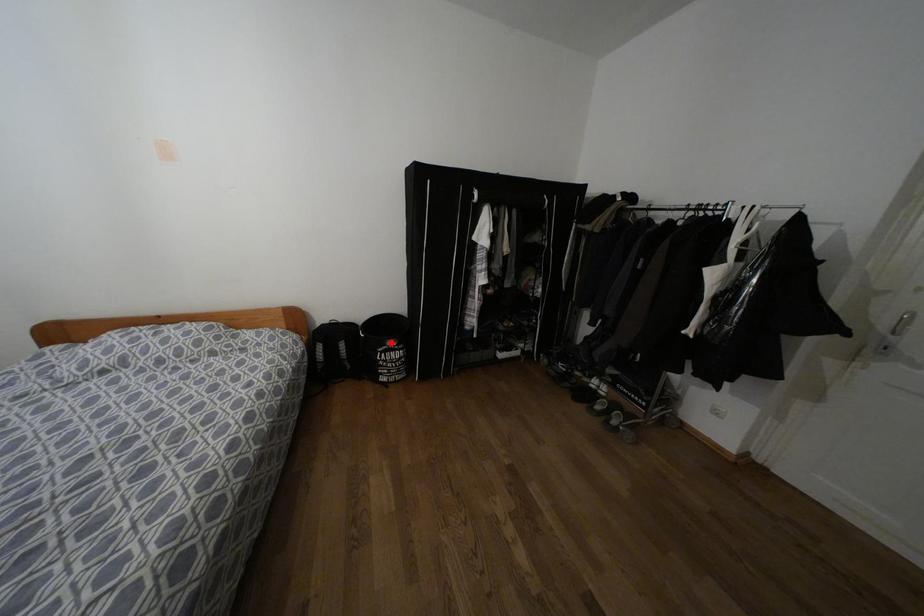
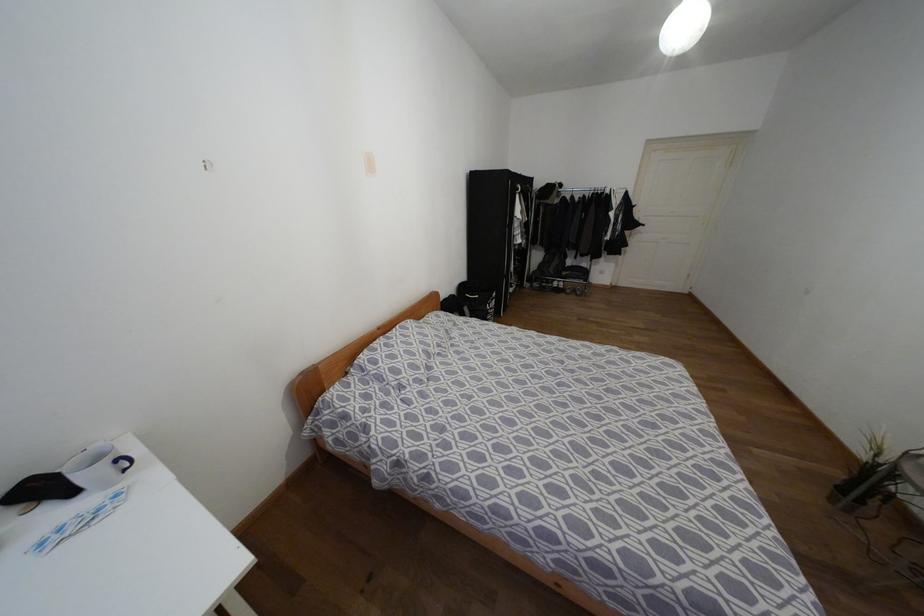
Find the pixel in the second image that matches the highlighted location in the first image.

(493, 294)